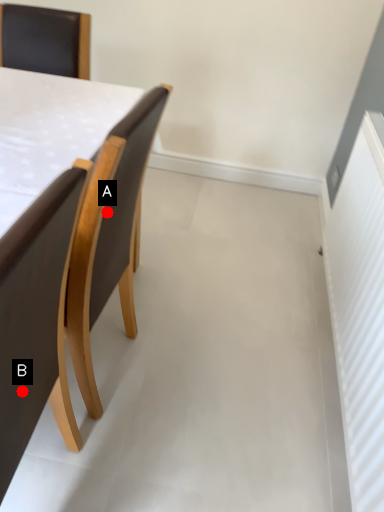
Question: Two points are circled on the image, labeled by A and B beside each circle. Which point appears farthest from the camera in this image?

Choices:
 (A) A is further
 (B) B is further

Answer: (A)